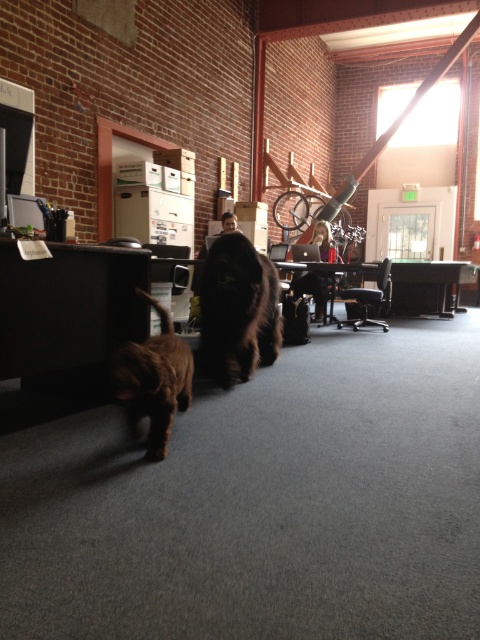
You are standing in the office space and want to find the brown furry dog at lower left. According to the scene description, where should you look relative to the desk area?

The brown furry dog at lower left is located at point (154,380), which is closer to the lower left side of the scene compared to the desk area in the background. Therefore, you should look towards the lower left area of the office space, near the foreground where the dogs are walking, rather than the desk area in the background.

You are an office worker who needs to move a cable from the matte black monitor at center to the black plastic computer at center. Which direction should you move the cable to reach the computer?

The matte black monitor at center is on the left side of the black plastic computer at center, so you should move the cable to the right to reach the computer.